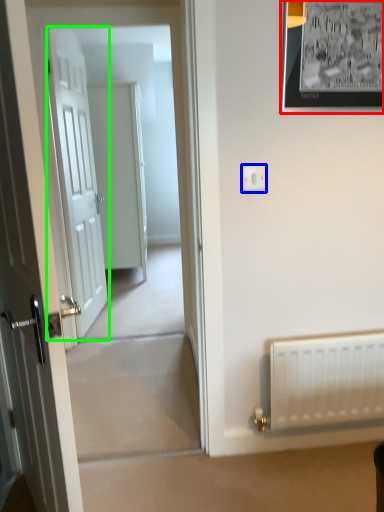
Question: Which is nearer to the picture frame (highlighted by a red box)? electric outlet (highlighted by a blue box) or door (highlighted by a green box).

Choices:
 (A) electric outlet
 (B) door

Answer: (A)